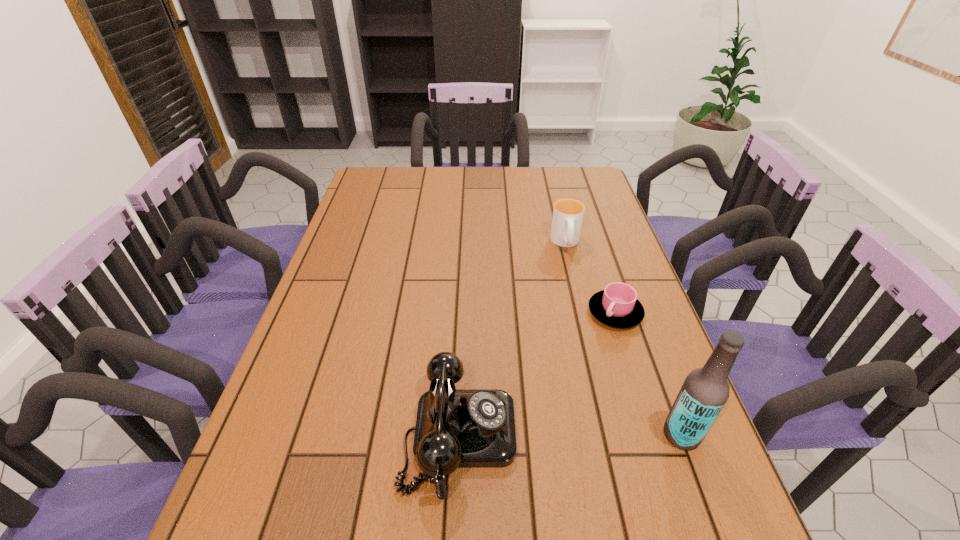
Image resolution: width=960 pixels, height=540 pixels. I want to click on vacant space on the desktop that is between the telephone and the tallest object and is positioned on the side with the handle of the shorter cup, so click(x=591, y=435).

At what (x,y) coordinates should I click in order to perform the action: click on free space on the desktop that is between the leftmost object and the tallest object and is positioned with the handle on the side of the farther cup. Please return your answer as a coordinate pair (x, y). Image resolution: width=960 pixels, height=540 pixels. Looking at the image, I should click on (596, 435).